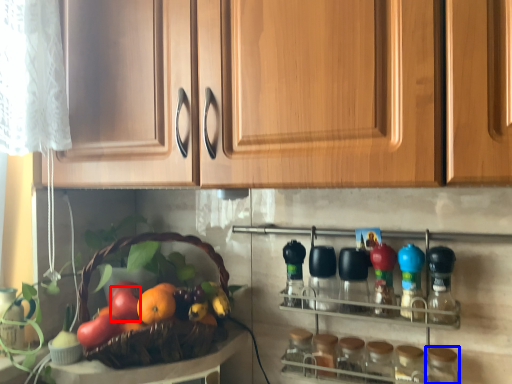
Question: Among these objects, which one is nearest to the camera, apple (highlighted by a red box) or bottle (highlighted by a blue box)?

Choices:
 (A) apple
 (B) bottle

Answer: (B)